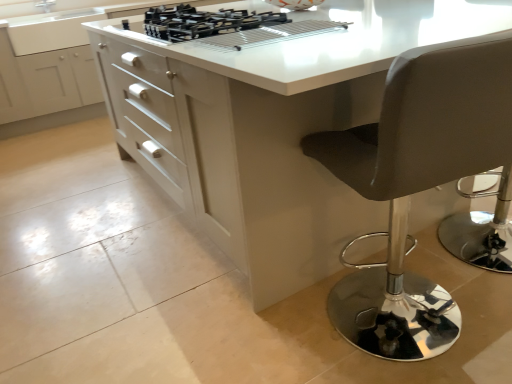
The image size is (512, 384). What do you see at coordinates (55, 59) in the screenshot? I see `white glossy cabinet at center` at bounding box center [55, 59].

At what (x,y) coordinates should I click in order to perform the action: click on black matte gas stove at upper center. Please return your answer as a coordinate pair (x, y). Looking at the image, I should click on (225, 26).

Is leatherette stool at right positioned before white glossy cabinet at center?

Yes.

How many degrees apart are the facing directions of leatherette stool at right and white glossy cabinet at center?

They differ by 170 degrees in their facing directions.

Would you say leatherette stool at right is a long distance from white glossy cabinet at center?

Yes.

Is leatherette stool at right turned away from white glossy cabinet at center?

leatherette stool at right does not have its back to white glossy cabinet at center.

At what (x,y) coordinates should I click in order to perform the action: click on chair below the black matte gas stove at upper center (from a real-world perspective). Please return your answer as a coordinate pair (x, y). The width and height of the screenshot is (512, 384). Looking at the image, I should click on (417, 183).

Who is more distant, leatherette stool at right or black matte gas stove at upper center?

Positioned behind is black matte gas stove at upper center.

Is point (401, 200) less distant than point (227, 41)?

No, it is not.

Which object is further away from the camera taking this photo, white glossy table at center or leatherette stool at right?

white glossy table at center is further from the camera.

Do you think white glossy table at center is within leatherette stool at right, or outside of it?

white glossy table at center exists outside the volume of leatherette stool at right.

From the image's perspective, which is below, white glossy table at center or leatherette stool at right?

From the image's view, leatherette stool at right is below.

Is leatherette stool at right inside black matte gas stove at upper center?

Definitely not — leatherette stool at right is not inside black matte gas stove at upper center.

Does black matte gas stove at upper center have a greater height compared to leatherette stool at right?

No.

Is black matte gas stove at upper center at the left side of leatherette stool at right?

Indeed, black matte gas stove at upper center is positioned on the left side of leatherette stool at right.

Where is `chair in front of the black matte gas stove at upper center`? The image size is (512, 384). chair in front of the black matte gas stove at upper center is located at coordinates (417, 183).

From a real-world perspective, does black matte gas stove at upper center sit lower than white glossy cabinet at center?

Actually, black matte gas stove at upper center is physically above white glossy cabinet at center in the real world.

Which object is thinner, black matte gas stove at upper center or white glossy cabinet at center?

With smaller width is black matte gas stove at upper center.

Is white glossy cabinet at center located within black matte gas stove at upper center?

No, white glossy cabinet at center is not a part of black matte gas stove at upper center.

How far apart are black matte gas stove at upper center and white glossy cabinet at center?

black matte gas stove at upper center is 1.95 meters away from white glossy cabinet at center.

Does white glossy cabinet at center have a smaller size compared to black matte gas stove at upper center?

No.

Is white glossy cabinet at center turned away from black matte gas stove at upper center?

That's not correct — white glossy cabinet at center is not looking away from black matte gas stove at upper center.

Based on the photo, is white glossy cabinet at center thinner than black matte gas stove at upper center?

Incorrect, the width of white glossy cabinet at center is not less than that of black matte gas stove at upper center.

Are white glossy cabinet at center and black matte gas stove at upper center far apart?

Absolutely, white glossy cabinet at center is distant from black matte gas stove at upper center.

Consider the image. Could you tell me if white glossy table at center is turned towards black matte gas stove at upper center?

No, white glossy table at center is not aimed at black matte gas stove at upper center.

Between white glossy table at center and black matte gas stove at upper center, which one appears on the right side from the viewer's perspective?

Positioned to the right is white glossy table at center.

Which object is thinner, white glossy table at center or black matte gas stove at upper center?

Thinner between the two is black matte gas stove at upper center.

Can you confirm if white glossy table at center is shorter than black matte gas stove at upper center?

In fact, white glossy table at center may be taller than black matte gas stove at upper center.

Where is `cabinetry that appears above the leatherette stool at right (from the image's perspective)`? This screenshot has height=384, width=512. cabinetry that appears above the leatherette stool at right (from the image's perspective) is located at coordinates (55, 59).

Image resolution: width=512 pixels, height=384 pixels. Find the location of `gas stove that appears behind the leatherette stool at right`. gas stove that appears behind the leatherette stool at right is located at coordinates (225, 26).

Which object lies further to the anchor point white glossy table at center, leatherette stool at right or black matte gas stove at upper center?

leatherette stool at right lies further to white glossy table at center than the other object.

Which object lies nearer to the anchor point black matte gas stove at upper center, leatherette stool at right or white glossy table at center?

Based on the image, white glossy table at center appears to be nearer to black matte gas stove at upper center.

Looking at the image, which one is located further to leatherette stool at right, white glossy table at center or black matte gas stove at upper center?

black matte gas stove at upper center lies further to leatherette stool at right than the other object.

From the picture: When comparing their distances from black matte gas stove at upper center, does white glossy cabinet at center or leatherette stool at right seem further?

white glossy cabinet at center.

When comparing their distances from black matte gas stove at upper center, does white glossy cabinet at center or white glossy table at center seem further?

white glossy cabinet at center lies further to black matte gas stove at upper center than the other object.

Looking at this image, considering their positions, is leatherette stool at right positioned closer to black matte gas stove at upper center than white glossy cabinet at center?

Based on the image, leatherette stool at right appears to be nearer to black matte gas stove at upper center.

Based on their spatial positions, is white glossy cabinet at center or black matte gas stove at upper center closer to leatherette stool at right?

The object closer to leatherette stool at right is black matte gas stove at upper center.

Looking at the image, which one is located further to white glossy cabinet at center, leatherette stool at right or black matte gas stove at upper center?

leatherette stool at right.

Where is `gas stove located between white glossy table at center and white glossy cabinet at center in the depth direction`? This screenshot has height=384, width=512. gas stove located between white glossy table at center and white glossy cabinet at center in the depth direction is located at coordinates (225, 26).

Locate an element on the screen. The image size is (512, 384). gas stove between leatherette stool at right and white glossy cabinet at center in the front-back direction is located at coordinates (225, 26).

This screenshot has width=512, height=384. Find the location of `table between leatherette stool at right and white glossy cabinet at center in the front-back direction`. table between leatherette stool at right and white glossy cabinet at center in the front-back direction is located at coordinates (275, 128).

Where is `table between black matte gas stove at upper center and leatherette stool at right in the up-down direction`? table between black matte gas stove at upper center and leatherette stool at right in the up-down direction is located at coordinates (275, 128).